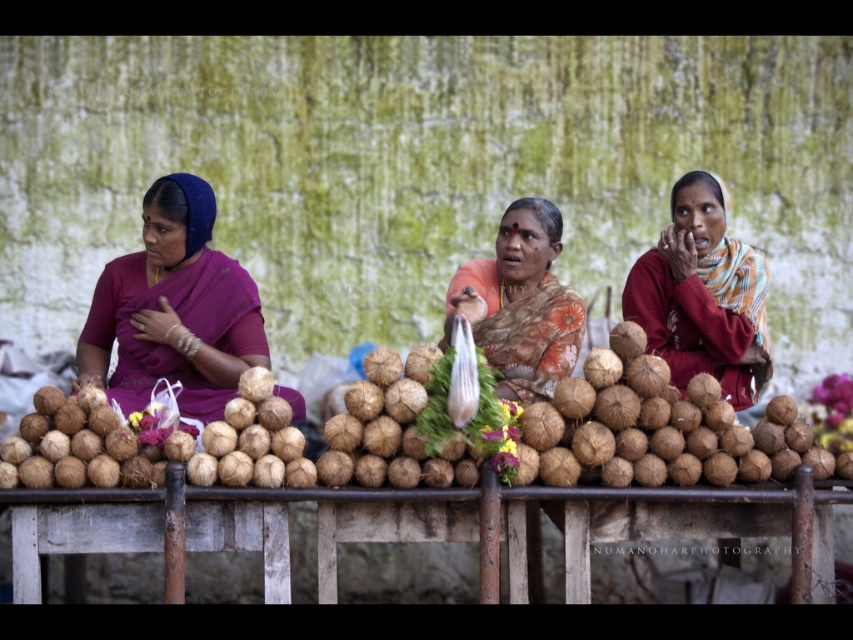
From the picture: Is the position of brown rough coconut at center less distant than that of purple silk saree at left?

Yes.

Between brown rough coconut at center and purple silk saree at left, which one has more height?

purple silk saree at left is taller.

Which is in front, point (351, 435) or point (164, 294)?

Point (351, 435) is more forward.

This screenshot has height=640, width=853. I want to click on brown rough coconut at center, so click(x=427, y=433).

The width and height of the screenshot is (853, 640). Describe the element at coordinates (173, 308) in the screenshot. I see `purple silk saree at left` at that location.

Does purple silk saree at left have a larger size compared to matte orange sari at center?

Indeed, purple silk saree at left has a larger size compared to matte orange sari at center.

Is point (138, 262) closer to viewer compared to point (534, 216)?

No, it is behind (534, 216).

Find the location of a particular element. This screenshot has width=853, height=640. purple silk saree at left is located at coordinates (173, 308).

Is purple silk saree at left positioned in front of matte brown coconut at center?

That is True.

Consider the image. Who is taller, purple silk saree at left or matte brown coconut at center?

Standing taller between the two is matte brown coconut at center.

Image resolution: width=853 pixels, height=640 pixels. Describe the element at coordinates (173, 308) in the screenshot. I see `purple silk saree at left` at that location.

Where is `purple silk saree at left`? The height and width of the screenshot is (640, 853). purple silk saree at left is located at coordinates tap(173, 308).